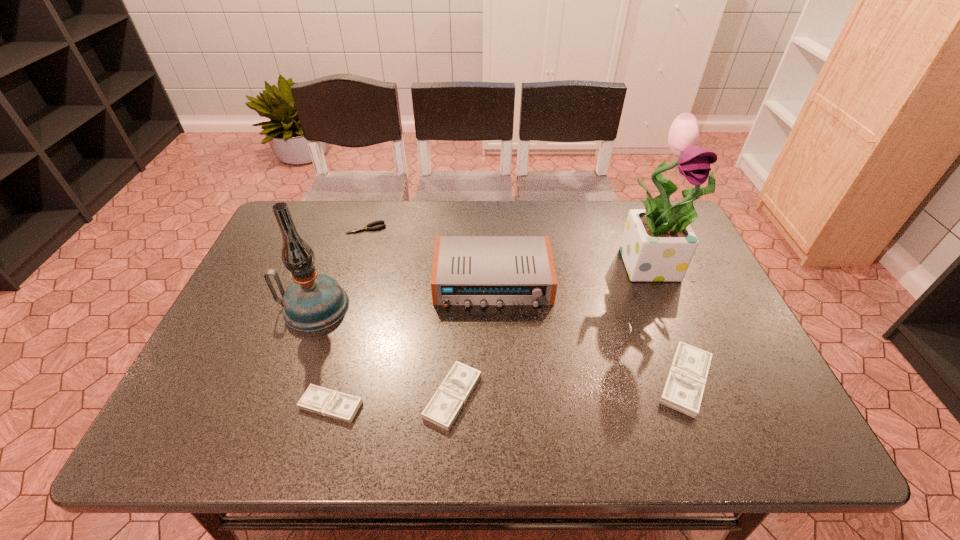
You are a GUI agent. You are given a task and a screenshot of the screen. Output one action in this format:
    pyautogui.click(x=<x>, y=<y>)
    Task: Click on the money that stands as the second closest to the rightmost money
    The width and height of the screenshot is (960, 540).
    Given the screenshot: What is the action you would take?
    pyautogui.click(x=316, y=399)

Choose which money is the nearest neighbor to the rightmost money. Please provide its 2D coordinates. Your answer should be formatted as a tuple, i.e. [(x, y)], where the tuple contains the x and y coordinates of a point satisfying the conditions above.

[(442, 410)]

Locate an element on the screen. The width and height of the screenshot is (960, 540). vacant region that satisfies the following two spatial constraints: 1. on the front side of the pliers; 2. on the right side of the sixth tallest object is located at coordinates (313, 405).

Identify the location of vacant area in the image that satisfies the following two spatial constraints: 1. on the back side of the fifth tallest object; 2. on the left side of the rightmost money. (453, 380).